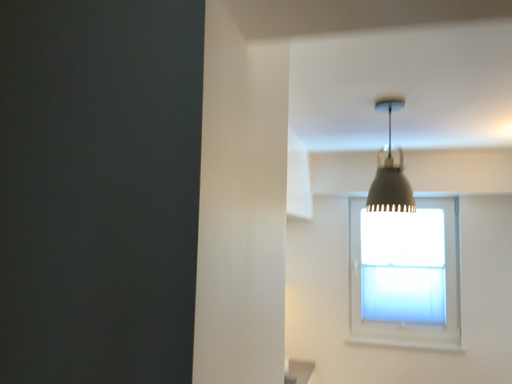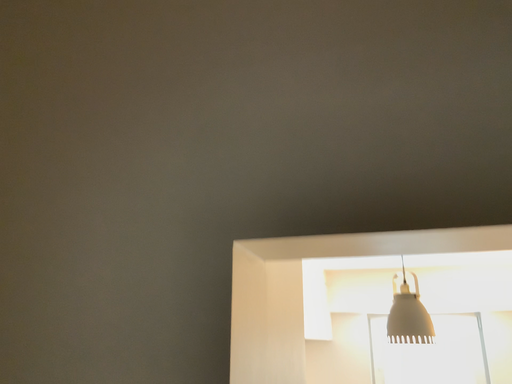
Question: How did the camera likely rotate when shooting the video?

Choices:
 (A) rotated downward
 (B) rotated upward

Answer: (B)